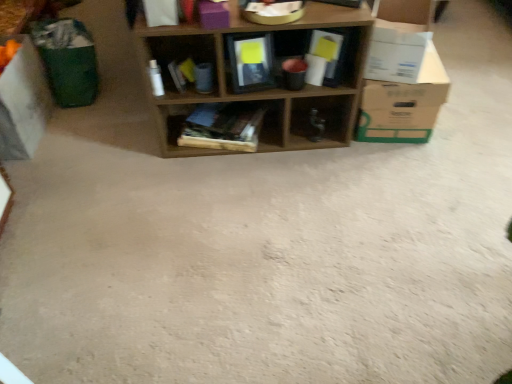
The image size is (512, 384). I want to click on free space above wooden shelf at center, which is the third shelf from left to right (from a real-world perspective), so click(251, 8).